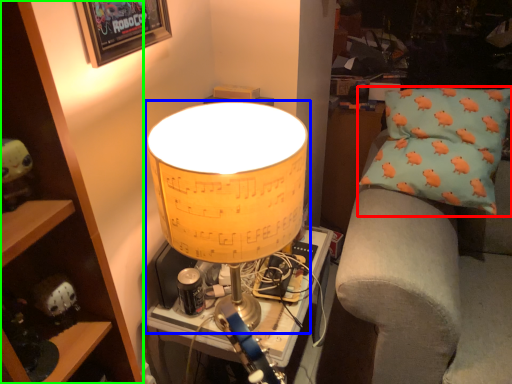
Question: Considering the real-world distances, which object is closest to pillow (highlighted by a red box)? lamp (highlighted by a blue box) or cabinet (highlighted by a green box).

Choices:
 (A) lamp
 (B) cabinet

Answer: (A)